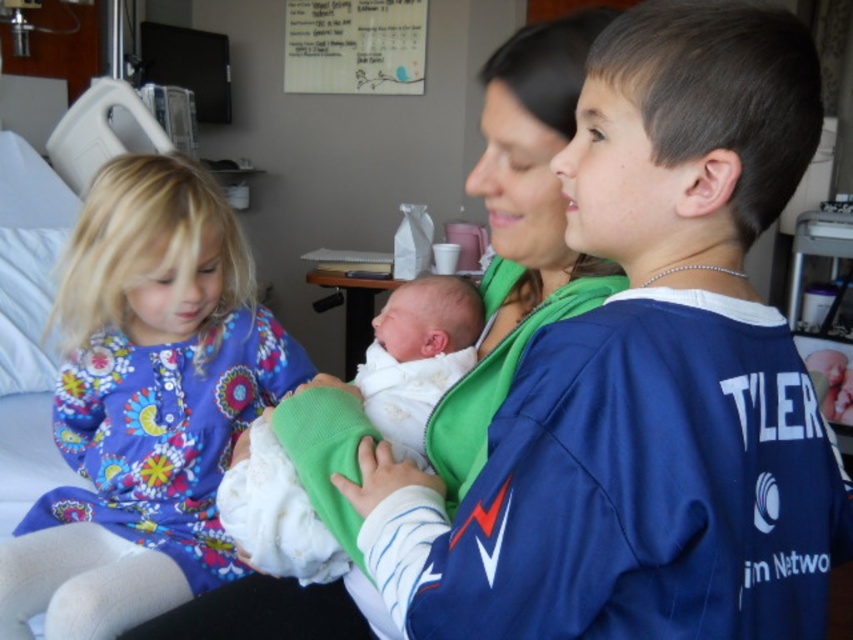
Based on the photo, in the hospital room scene, there are two newborns depicted as white soft swaddled newborn at center and white soft fabric newborn at center. Which one is bigger in size?

The white soft swaddled newborn at center is larger in size compared to the white soft fabric newborn at center.

You are a photographer in a hospital room. You see the floral fabric dress at left and the white soft swaddled newborn at center. Which object is positioned lower in the frame?

The floral fabric dress at left is below the white soft swaddled newborn at center, so the floral fabric dress at left is positioned lower in the frame.

In the hospital room scene, there are two newborns depicted as white soft swaddled newborn at center and white soft fabric newborn at center. Which one is positioned to the left?

The white soft swaddled newborn at center is positioned to the left of the white soft fabric newborn at center.